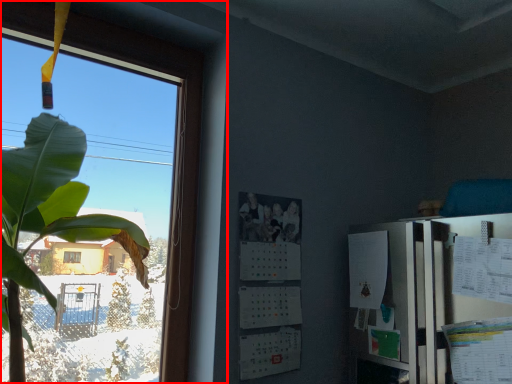
Question: From the image's perspective, where is window (annotated by the red box) located relative to bulletin board?

Choices:
 (A) above
 (B) below

Answer: (A)